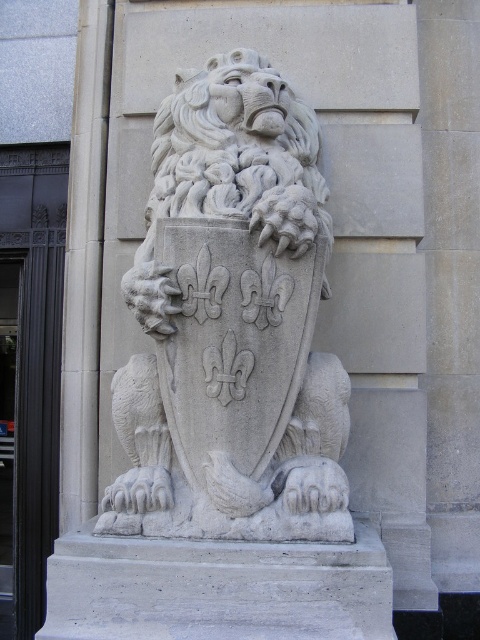
Question: Is black metal door at left closer to the viewer compared to black glass door at left?

Choices:
 (A) no
 (B) yes

Answer: (B)

Question: Can you confirm if white stone lion at center is positioned to the right of black glass door at left?

Choices:
 (A) no
 (B) yes

Answer: (B)

Question: Can you confirm if white stone lion at center is positioned below black glass door at left?

Choices:
 (A) yes
 (B) no

Answer: (B)

Question: Among these objects, which one is farthest from the camera?

Choices:
 (A) black glass door at left
 (B) white stone lion at center
 (C) black metal door at left

Answer: (A)

Question: Estimate the real-world distances between objects in this image. Which object is farther from the white stone lion at center?

Choices:
 (A) black glass door at left
 (B) black metal door at left

Answer: (A)

Question: Which of the following is the farthest from the observer?

Choices:
 (A) (180, 140)
 (B) (34, 307)

Answer: (B)